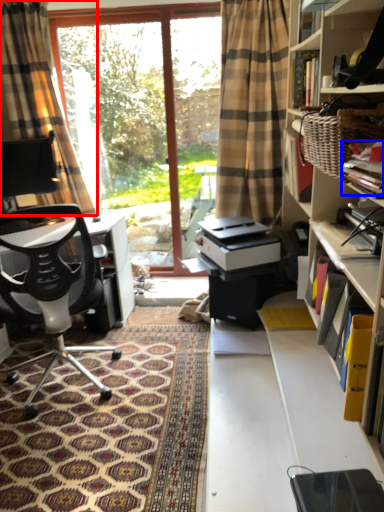
Question: Which object appears closest to the camera in this image, curtain (highlighted by a red box) or book (highlighted by a blue box)?

Choices:
 (A) curtain
 (B) book

Answer: (B)